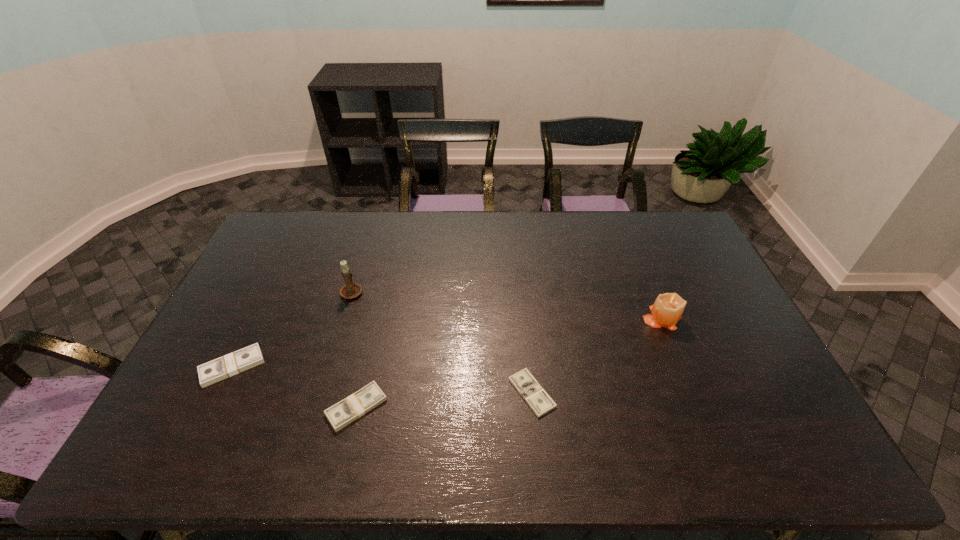
At what (x,y) coordinates should I click in order to perform the action: click on vacant space at the near left corner of the desktop. Please return your answer as a coordinate pair (x, y). This screenshot has height=540, width=960. Looking at the image, I should click on tap(207, 457).

I want to click on free space at the far right corner of the desktop, so click(662, 221).

Locate an element on the screen. empty location between the second dollar from left to right and the tallest object is located at coordinates (354, 349).

Locate an element on the screen. vacant area that lies between the leftmost dollar and the second dollar from left to right is located at coordinates (295, 387).

At what (x,y) coordinates should I click in order to perform the action: click on free spot between the fourth shortest object and the leftmost dollar. Please return your answer as a coordinate pair (x, y). Looking at the image, I should click on (447, 342).

Find the location of `empty location between the shortest object and the candle holder`. empty location between the shortest object and the candle holder is located at coordinates (442, 342).

Locate an element on the screen. This screenshot has height=540, width=960. vacant area between the shortest dollar and the second dollar from left to right is located at coordinates (444, 400).

The width and height of the screenshot is (960, 540). Find the location of `free point between the candle and the candle holder`. free point between the candle and the candle holder is located at coordinates (507, 304).

The width and height of the screenshot is (960, 540). I want to click on empty space that is in between the rightmost dollar and the farthest object, so click(x=442, y=342).

The width and height of the screenshot is (960, 540). I want to click on free area in between the fourth shortest object and the farthest object, so click(507, 304).